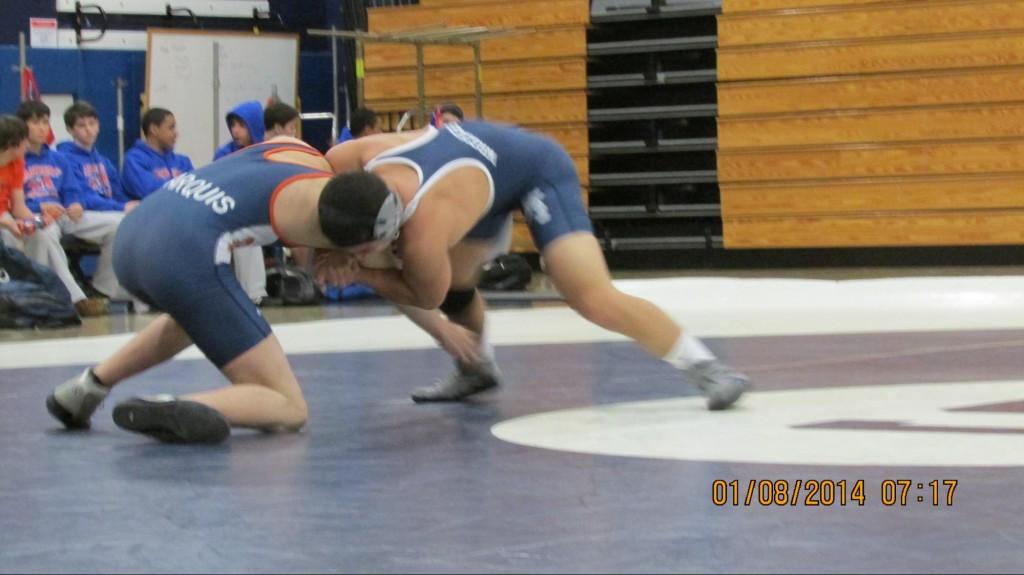
Where is `wrestling mat`? The width and height of the screenshot is (1024, 575). wrestling mat is located at coordinates (765, 282), (860, 442), (495, 503).